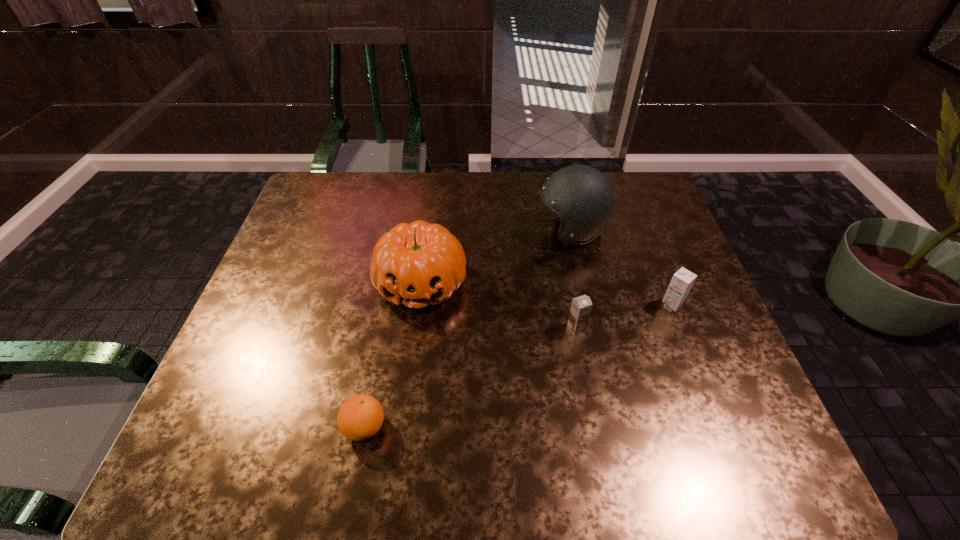
The height and width of the screenshot is (540, 960). Find the location of `free location at the left edge`. free location at the left edge is located at coordinates (270, 289).

I want to click on free space at the right edge, so click(x=689, y=308).

The image size is (960, 540). In the image, there is a desktop. Find the location of `free space at the far left corner`. free space at the far left corner is located at coordinates (315, 174).

This screenshot has width=960, height=540. Find the location of `vacant area at the near left corner of the desktop`. vacant area at the near left corner of the desktop is located at coordinates (233, 442).

Locate an element on the screen. vacant space at the far right corner of the desktop is located at coordinates (628, 190).

Locate an element on the screen. free space between the fourth shortest object and the rightmost object is located at coordinates (546, 294).

Locate an element on the screen. The image size is (960, 540). vacant space that's between the nearest object and the football helmet is located at coordinates (468, 328).

Find the location of a particular element. The width and height of the screenshot is (960, 540). free area in between the tallest object and the pumpkin is located at coordinates (496, 256).

The height and width of the screenshot is (540, 960). I want to click on free space between the tallest object and the fourth shortest object, so click(496, 256).

Locate an element on the screen. The height and width of the screenshot is (540, 960). free space between the shortest object and the football helmet is located at coordinates (468, 328).